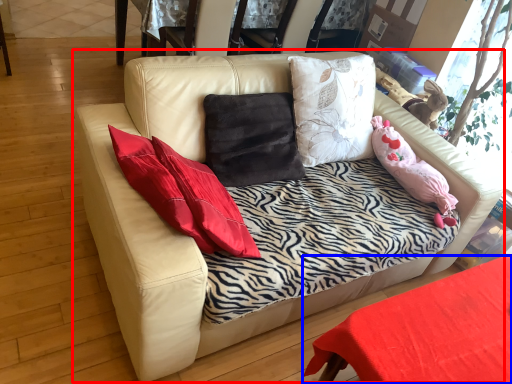
Question: Which point is closer to the camera, studio couch (highlighted by a red box) or table (highlighted by a blue box)?

Choices:
 (A) studio couch
 (B) table

Answer: (A)